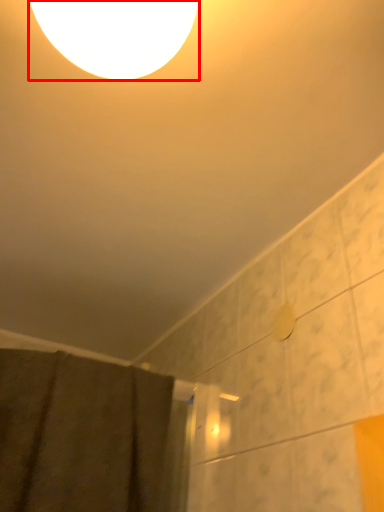
Question: From the image's perspective, what is the correct spatial relationship of lamp (annotated by the red box) in relation to shower curtain?

Choices:
 (A) above
 (B) below

Answer: (A)